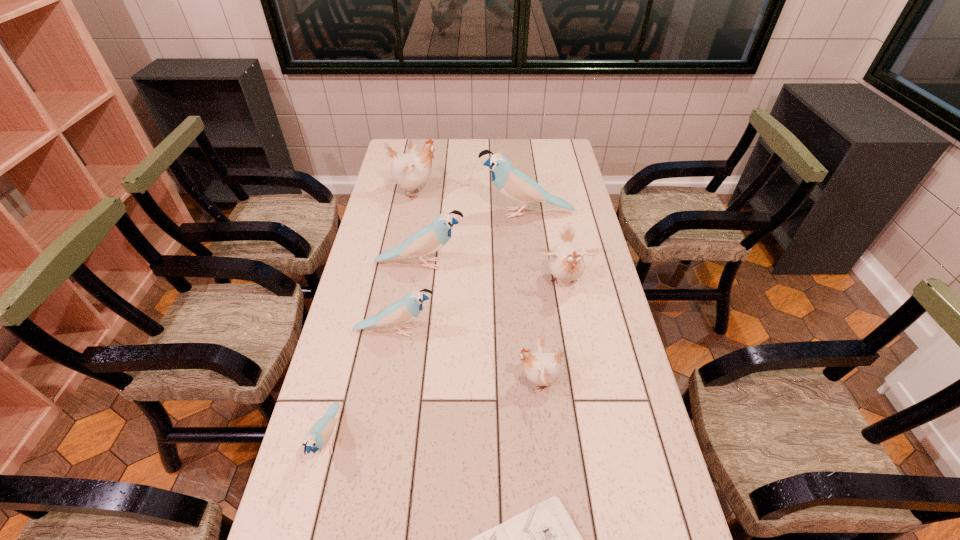
Where is `the farthest blue bird`? The image size is (960, 540). the farthest blue bird is located at coordinates (510, 181).

Identify the location of the biggest blue bird. The width and height of the screenshot is (960, 540). (510, 181).

Identify the location of the leftmost white bird. (411, 170).

Where is `the biggest white bird`? The width and height of the screenshot is (960, 540). the biggest white bird is located at coordinates click(411, 170).

I want to click on the third smallest blue bird, so click(x=431, y=238).

The image size is (960, 540). I want to click on the second biggest white bird, so click(566, 262).

Find the location of `the second nearest blue bird`. the second nearest blue bird is located at coordinates (403, 311).

The width and height of the screenshot is (960, 540). I want to click on the fifth farthest bird, so click(x=403, y=311).

Locate an element on the screen. The width and height of the screenshot is (960, 540). the smallest white bird is located at coordinates (543, 369).

Image resolution: width=960 pixels, height=540 pixels. What are the coordinates of `the smallest blue bird` in the screenshot? It's located at (321, 431).